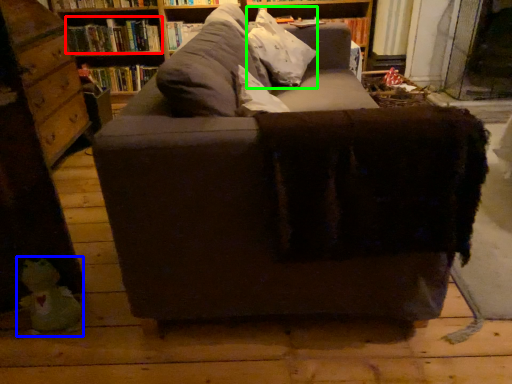
Question: Which object is positioned farthest from book (highlighted by a red box)? Select from toy (highlighted by a blue box) and throw pillow (highlighted by a green box).

Choices:
 (A) toy
 (B) throw pillow

Answer: (A)